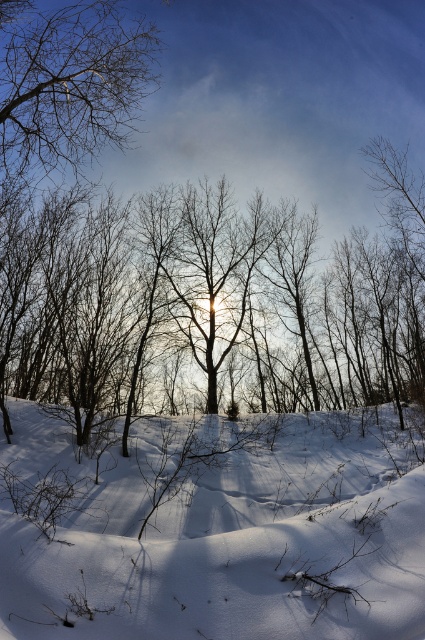
Is brown bark tree at center further to camera compared to brown textured branches at upper left?

That is True.

Which is in front, point (107, 216) or point (8, 141)?

Point (8, 141) is more forward.

Where is `brown bark tree at center`? The width and height of the screenshot is (425, 640). brown bark tree at center is located at coordinates (209, 301).

I want to click on brown bark tree at center, so click(209, 301).

In order to click on white fluffy snow at center in this screenshot , I will do `click(215, 531)`.

At what (x,y) coordinates should I click in order to perform the action: click on white fluffy snow at center. Please return your answer as a coordinate pair (x, y). Image resolution: width=425 pixels, height=640 pixels. Looking at the image, I should click on (215, 531).

Who is shorter, white fluffy snow at center or brown textured branches at upper left?

white fluffy snow at center

Can you confirm if white fluffy snow at center is positioned to the left of brown textured branches at upper left?

Incorrect, white fluffy snow at center is not on the left side of brown textured branches at upper left.

Is point (308, 472) in front of point (27, 58)?

No, it is not.

Find the location of `white fluffy snow at center`. white fluffy snow at center is located at coordinates (215, 531).